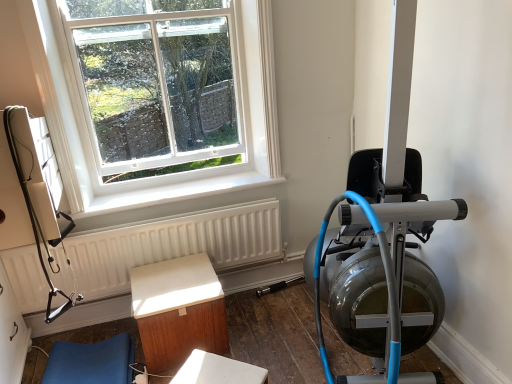
Find the location of a particular element. The width and height of the screenshot is (512, 384). free point above white matte table at lower center (from a real-world perspective) is located at coordinates (204, 373).